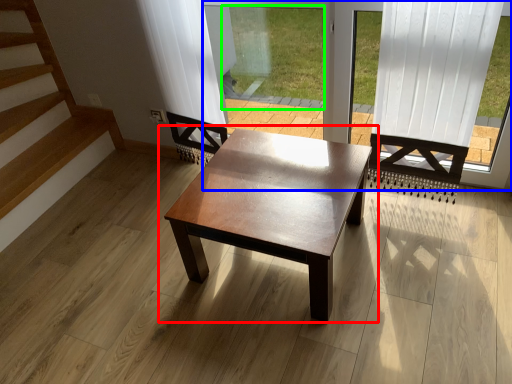
Question: Based on their relative distances, which object is farther from coffee table (highlighted by a red box)? Choose from window frame (highlighted by a blue box) and window screen (highlighted by a green box).

Choices:
 (A) window frame
 (B) window screen

Answer: (B)